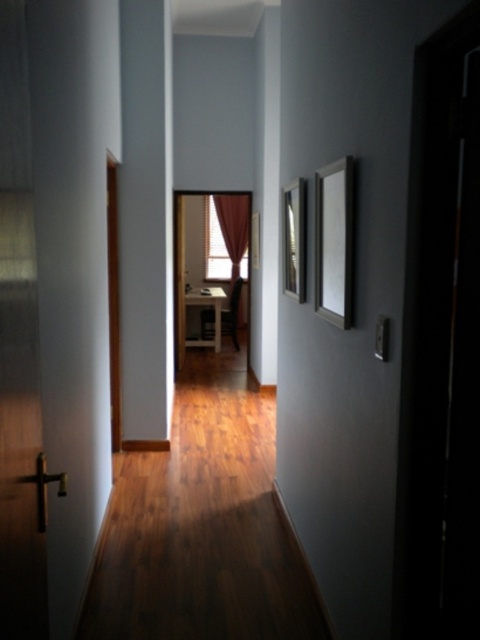
Question: Can you confirm if black glossy door at right is positioned to the right of matte white curtain at center?

Choices:
 (A) yes
 (B) no

Answer: (A)

Question: Where is black glossy door at right located in relation to matte white curtain at center in the image?

Choices:
 (A) left
 (B) right

Answer: (B)

Question: Is black glossy door at right below matte white curtain at center?

Choices:
 (A) no
 (B) yes

Answer: (B)

Question: Which object appears closest to the camera in this image?

Choices:
 (A) matte white curtain at center
 (B) black glossy door at right

Answer: (B)

Question: Among these points, which one is farthest from the camera?

Choices:
 (A) (228, 253)
 (B) (436, 515)

Answer: (A)

Question: Which of the following is the farthest from the observer?

Choices:
 (A) black glossy door at right
 (B) matte white curtain at center

Answer: (B)